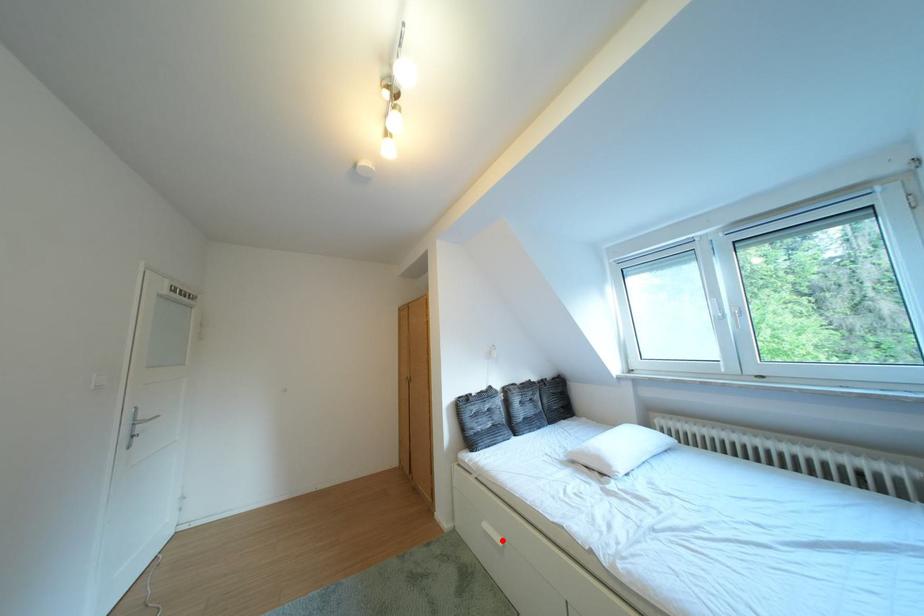
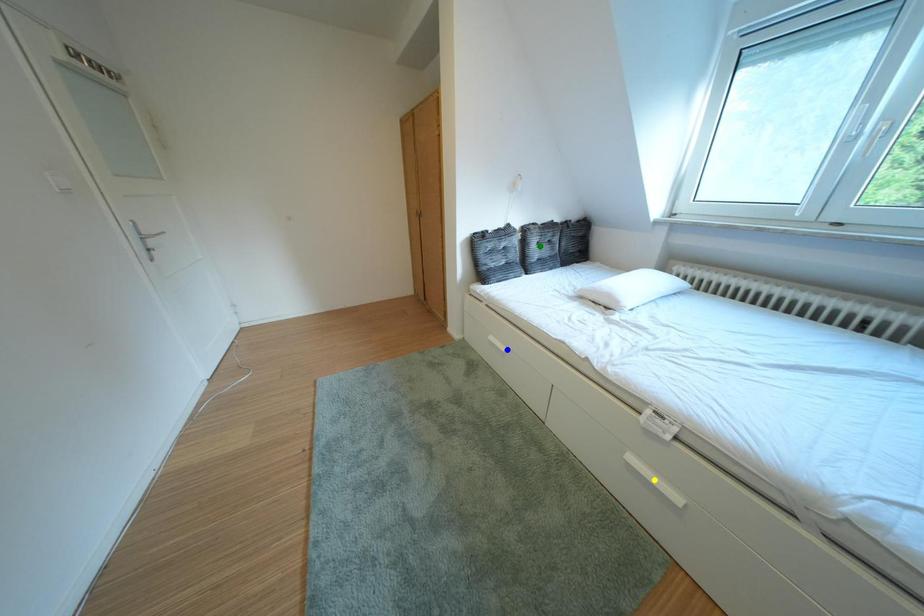
Question: I am providing you with two images of the same scene from different viewpoints. A red point is marked on the first image. You are given multiple points on the second image. Can you choose the point in image 2 that corresponds to the point in image 1?

Choices:
 (A) green point
 (B) blue point
 (C) yellow point

Answer: (B)